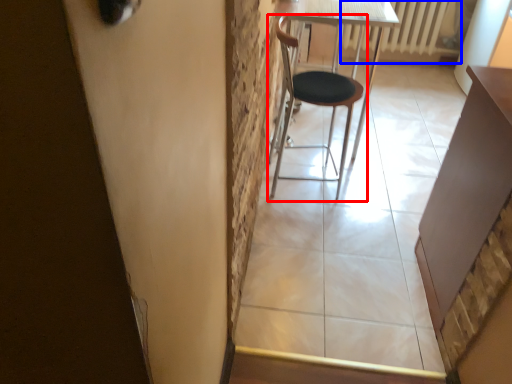
Question: Which object is closer to the camera taking this photo, chair (highlighted by a red box) or radiator (highlighted by a blue box)?

Choices:
 (A) chair
 (B) radiator

Answer: (A)